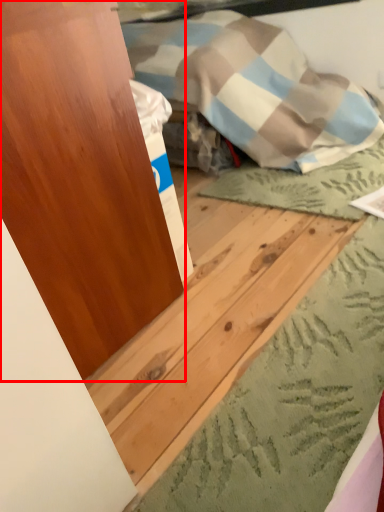
Question: In this image, where is dresser (annotated by the red box) located relative to plywood?

Choices:
 (A) left
 (B) right

Answer: (A)